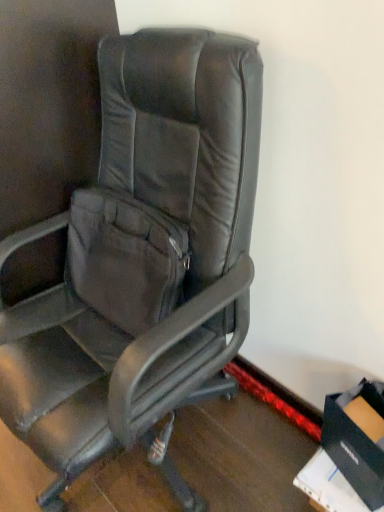
Question: Should I look upward or downward to see black leather chair at center?

Choices:
 (A) up
 (B) down

Answer: (B)

Question: Can you confirm if black cardboard box at lower right is positioned to the left of black leather chair at center?

Choices:
 (A) no
 (B) yes

Answer: (A)

Question: Considering the relative sizes of black cardboard box at lower right and black leather chair at center in the image provided, is black cardboard box at lower right shorter than black leather chair at center?

Choices:
 (A) no
 (B) yes

Answer: (B)

Question: Can you confirm if black cardboard box at lower right is smaller than black leather chair at center?

Choices:
 (A) yes
 (B) no

Answer: (A)

Question: From a real-world perspective, does black cardboard box at lower right sit lower than black leather chair at center?

Choices:
 (A) no
 (B) yes

Answer: (B)

Question: Is black cardboard box at lower right thinner than black leather chair at center?

Choices:
 (A) no
 (B) yes

Answer: (B)

Question: Is black cardboard box at lower right not near black leather chair at center?

Choices:
 (A) no
 (B) yes

Answer: (A)

Question: From the image's perspective, is black leather chair at center located above black cardboard box at lower right?

Choices:
 (A) yes
 (B) no

Answer: (A)

Question: Is black leather chair at center aimed at black cardboard box at lower right?

Choices:
 (A) yes
 (B) no

Answer: (B)

Question: Is there a large distance between black leather chair at center and black cardboard box at lower right?

Choices:
 (A) yes
 (B) no

Answer: (B)

Question: Is black leather chair at center placed right next to black cardboard box at lower right?

Choices:
 (A) yes
 (B) no

Answer: (B)

Question: From a real-world perspective, is black leather chair at center on top of black cardboard box at lower right?

Choices:
 (A) no
 (B) yes

Answer: (B)

Question: Considering the relative sizes of black leather chair at center and black cardboard box at lower right in the image provided, is black leather chair at center shorter than black cardboard box at lower right?

Choices:
 (A) yes
 (B) no

Answer: (B)

Question: Is black leather chair at center taller or shorter than black cardboard box at lower right?

Choices:
 (A) tall
 (B) short

Answer: (A)